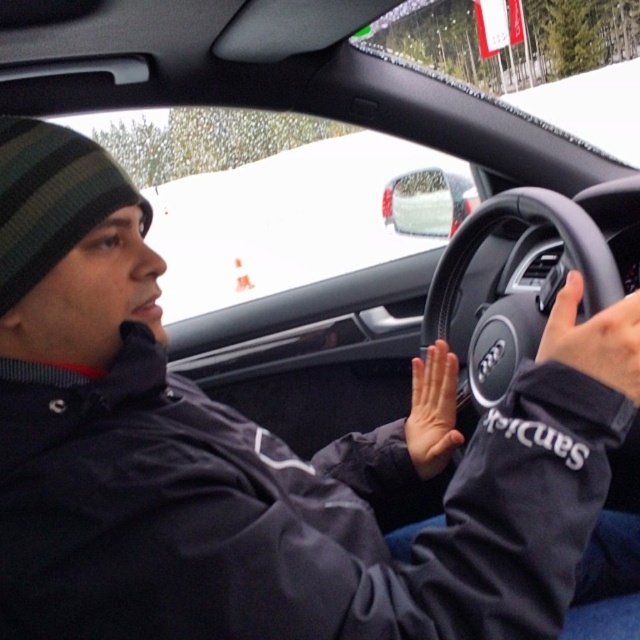
You are a passenger in the car and want to know if the green striped knit hat at upper left can fit in the glove compartment next to the black matte hand at steering wheel. The glove compartment has a width of 20 cm. Can you determine if the hat will fit?

The green striped knit hat at upper left is wider than the black matte hand at steering wheel. Since the black matte hand at steering wheel is not measured, but the hat is wider, but the glove compartment is 20 cm wide. Without knowing the exact width of the hat, it is uncertain if it will fit. However, if the hand is narrower than 20 cm and the hat is wider than the hand but not exceeding 20 cm, it might fit. But since we don not have exact measurements, we cannot confirm.

You are a passenger in the car and want to reach the point at coordinates point (90, 193). If your hand is 10 inches long, can you comfortably reach that point?

The distance between point (90, 193) and the camera is 27.96 inches. Since your hand is 10 inches long, you cannot comfortably reach that point as it is farther than your hand length.